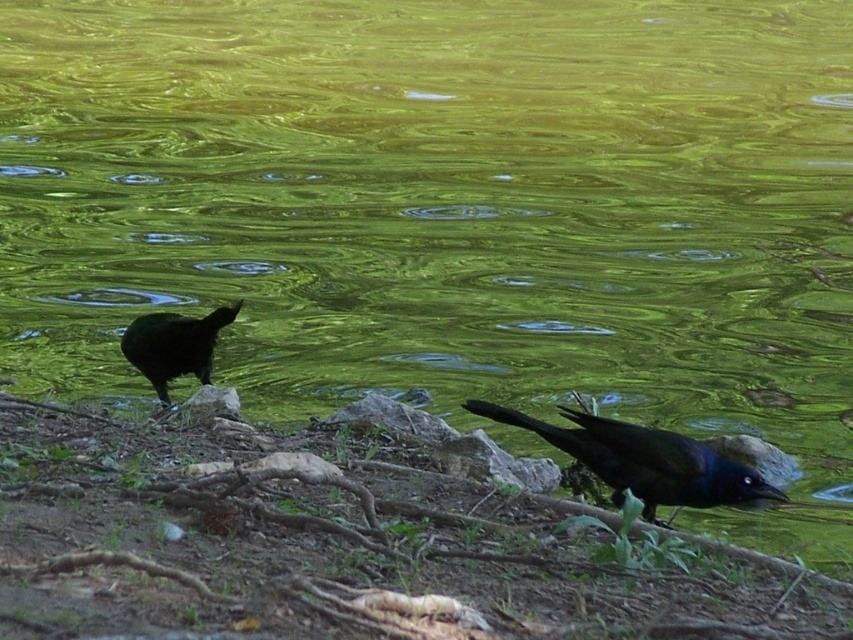
You are observing two shiny black birds near a greenish yellow water body. Which of the two birds, the shiny black bird at lower right or the shiny black bird at lower left, is bigger in size?

The shiny black bird at lower right is larger in size compared to the shiny black bird at lower left.

You are standing at the edge of the water in the scene. You see two points marked as point (666, 486) and point (196, 365). Which point is closer to you?

Point (666, 486) is in front of point (196, 365), so it is closer to you.

You are observing two shiny black birds near the water. Which bird is located to the right of the other? The birds are labeled as shiny black bird at lower right and shiny black bird at lower left.

The shiny black bird at lower right is positioned on the right side of the shiny black bird at lower left.